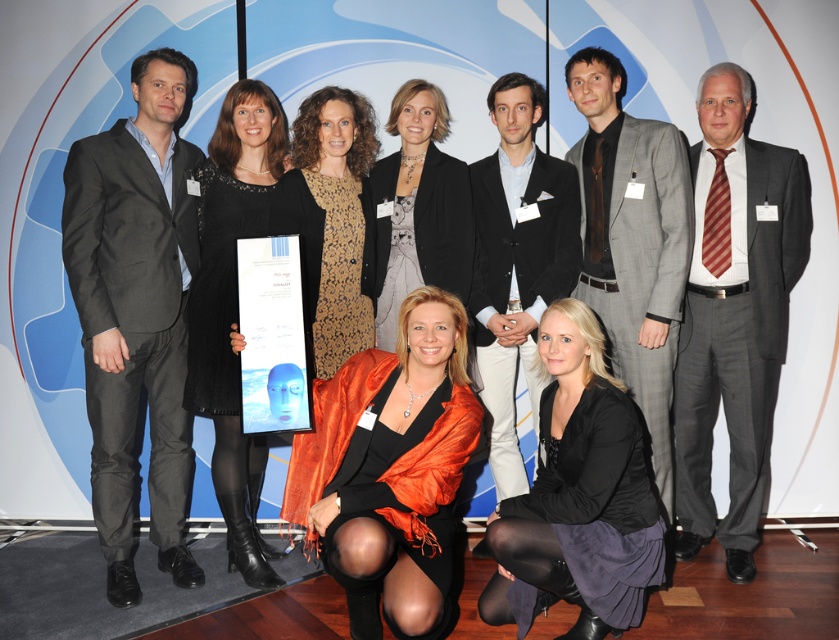
Question: Is gray textured suit at center above black suit at center?

Choices:
 (A) yes
 (B) no

Answer: (A)

Question: Does black lace dress at center appear under leopard print dress at center?

Choices:
 (A) yes
 (B) no

Answer: (A)

Question: Does black suit at center appear on the right side of leopard print dress at center?

Choices:
 (A) yes
 (B) no

Answer: (A)

Question: Estimate the real-world distances between objects in this image. Which object is closer to the gray suit at right?

Choices:
 (A) satin orange scarf at center
 (B) gray textured suit at center
 (C) black lace dress at center
 (D) black suede skirt at lower center

Answer: (B)

Question: Which point appears farthest from the camera in this image?

Choices:
 (A) (603, 490)
 (B) (485, 186)

Answer: (B)

Question: Which object is farther from the camera taking this photo?

Choices:
 (A) black suede skirt at lower center
 (B) leopard print dress at center

Answer: (B)